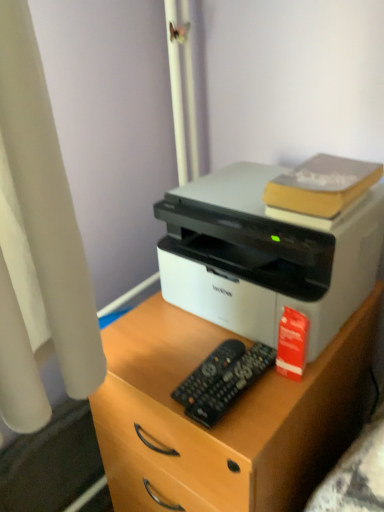
Where is `vacant space that is to the left of yellow matte book at upper right, arranged as the 1th book when viewed from the top`? vacant space that is to the left of yellow matte book at upper right, arranged as the 1th book when viewed from the top is located at coordinates (233, 215).